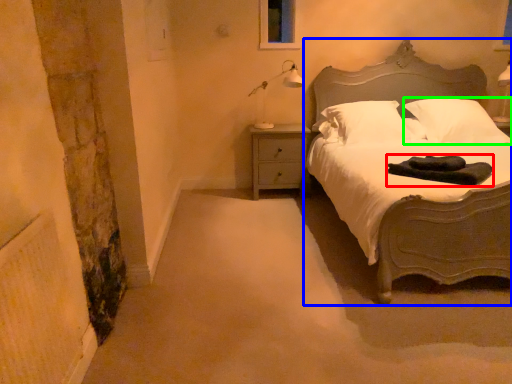
Question: Considering the real-world distances, which object is farthest from material (highlighted by a red box)? bed (highlighted by a blue box) or pillow (highlighted by a green box)?

Choices:
 (A) bed
 (B) pillow

Answer: (A)